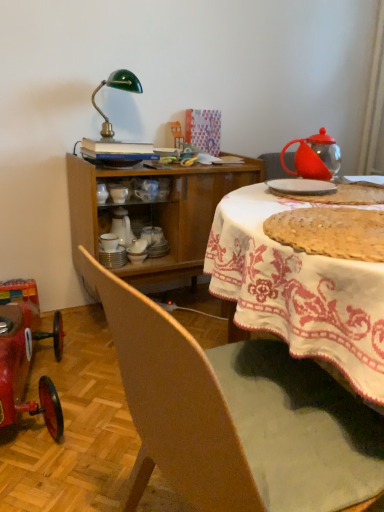
Question: Which direction should I rotate to look at white ceramic plates at center, placed as the 3th tableware when sorted from front to back?

Choices:
 (A) right
 (B) left

Answer: (B)

Question: From a real-world perspective, is wooden chair at lower left located higher than wooden cabinet at center?

Choices:
 (A) no
 (B) yes

Answer: (A)

Question: Considering the relative sizes of wooden chair at lower left and wooden cabinet at center in the image provided, is wooden chair at lower left wider than wooden cabinet at center?

Choices:
 (A) yes
 (B) no

Answer: (B)

Question: Considering the relative positions of wooden chair at lower left and wooden cabinet at center in the image provided, is wooden chair at lower left to the right of wooden cabinet at center from the viewer's perspective?

Choices:
 (A) yes
 (B) no

Answer: (B)

Question: Considering the relative sizes of wooden chair at lower left and wooden cabinet at center in the image provided, is wooden chair at lower left thinner than wooden cabinet at center?

Choices:
 (A) yes
 (B) no

Answer: (A)

Question: From the image's perspective, does wooden chair at lower left appear lower than wooden cabinet at center?

Choices:
 (A) no
 (B) yes

Answer: (B)

Question: From a real-world perspective, is wooden chair at lower left beneath wooden cabinet at center?

Choices:
 (A) yes
 (B) no

Answer: (A)

Question: Can you confirm if wooden cabinet at center is thinner than shiny red toy car at lower left?

Choices:
 (A) no
 (B) yes

Answer: (B)

Question: Considering the relative sizes of wooden cabinet at center and shiny red toy car at lower left in the image provided, is wooden cabinet at center smaller than shiny red toy car at lower left?

Choices:
 (A) yes
 (B) no

Answer: (B)

Question: Is wooden cabinet at center positioned with its back to shiny red toy car at lower left?

Choices:
 (A) yes
 (B) no

Answer: (B)

Question: Can you confirm if wooden cabinet at center is taller than shiny red toy car at lower left?

Choices:
 (A) yes
 (B) no

Answer: (A)

Question: Is wooden cabinet at center positioned before shiny red toy car at lower left?

Choices:
 (A) yes
 (B) no

Answer: (B)

Question: Are wooden cabinet at center and shiny red toy car at lower left making contact?

Choices:
 (A) yes
 (B) no

Answer: (B)

Question: From the image's perspective, does golden crumbly pie at center appear higher than white ceramic plates at center, the fourth tableware viewed from the right?

Choices:
 (A) yes
 (B) no

Answer: (A)